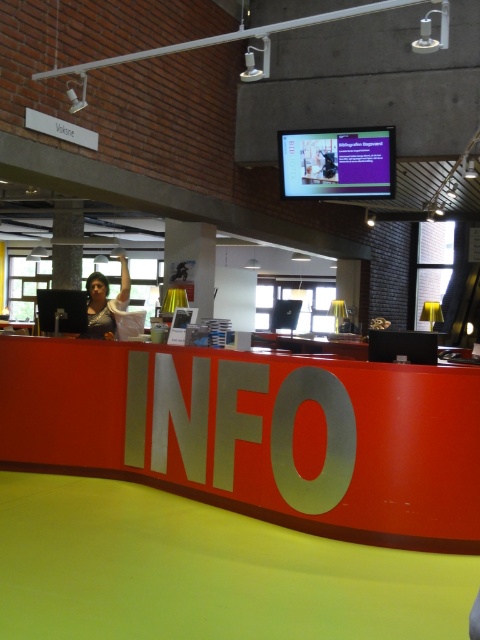
Question: Can you confirm if matte gray pillar at center is wider than white fabric shirt at left?

Choices:
 (A) yes
 (B) no

Answer: (A)

Question: Which object appears farthest from the camera in this image?

Choices:
 (A) red matte info sign at center
 (B) white fabric shirt at left

Answer: (B)

Question: Does red matte info sign at center appear over matte gray pillar at center?

Choices:
 (A) no
 (B) yes

Answer: (A)

Question: Is red matte info sign at center wider than matte gray pillar at center?

Choices:
 (A) yes
 (B) no

Answer: (A)

Question: Among these points, which one is farthest from the camera?

Choices:
 (A) (381, 496)
 (B) (59, 273)
 (C) (122, 268)

Answer: (B)

Question: Which point is closer to the camera?

Choices:
 (A) matte gray pillar at center
 (B) red matte info sign at center
 (C) white fabric shirt at left

Answer: (B)